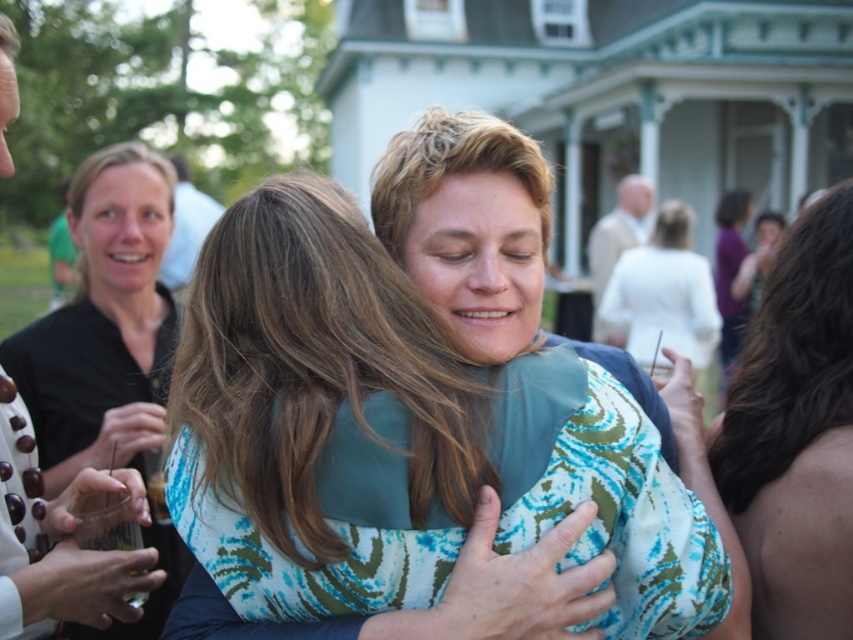
You are a photographer trying to capture a candid shot of the dark brown hair at right. If your camera has a rectangular viewfinder with coordinates from 0 to 1 on both axes, where would you aim to center the shot?

The dark brown hair at right is located at coordinates 0.677 on the x axis and 0.934 on the y axis, so you should center the shot at those coordinates to capture it.

You are at a party and want to take a photo of both the printed fabric dress at center and the white satin dress at center. Which dress should you focus on first if you want to capture them in the same frame without moving the camera?

The printed fabric dress at center is below the white satin dress at center, so you should focus on the white satin dress at center first to ensure both are in the frame without moving the camera.